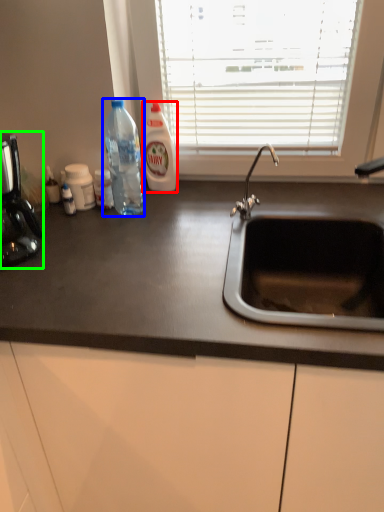
Question: Based on their relative distances, which object is nearer to cleaning product (highlighted by a red box)? Choose from bottle (highlighted by a blue box) and coffee machine (highlighted by a green box).

Choices:
 (A) bottle
 (B) coffee machine

Answer: (A)